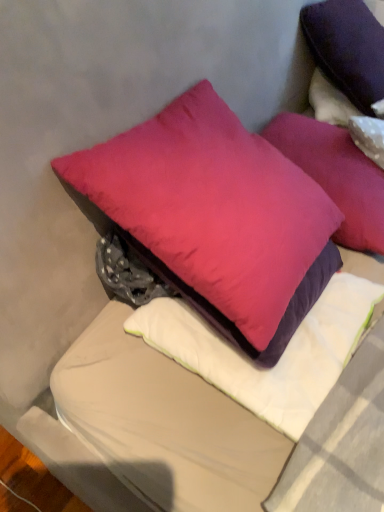
Question: Is purple velvet pillow at upper right, marked as the 5th pillow in a bottom-to-top arrangement, closer to the viewer compared to matte pink pillow at center, marked as the third pillow in a bottom-to-top arrangement?

Choices:
 (A) no
 (B) yes

Answer: (A)

Question: From a real-world perspective, is purple velvet pillow at upper right, marked as the 5th pillow in a bottom-to-top arrangement, on matte pink pillow at center, marked as the third pillow in a bottom-to-top arrangement?

Choices:
 (A) no
 (B) yes

Answer: (B)

Question: Does purple velvet pillow at upper right, marked as the 5th pillow in a bottom-to-top arrangement, touch matte pink pillow at center, which is the 3th pillow from top to bottom?

Choices:
 (A) no
 (B) yes

Answer: (A)

Question: Is purple velvet pillow at upper right, marked as the 5th pillow in a bottom-to-top arrangement, oriented away from matte pink pillow at center, which is the 3th pillow from top to bottom?

Choices:
 (A) yes
 (B) no

Answer: (B)

Question: Can you confirm if purple velvet pillow at upper right, marked as the 5th pillow in a bottom-to-top arrangement, is positioned to the left of matte pink pillow at center, which is the 3th pillow from top to bottom?

Choices:
 (A) no
 (B) yes

Answer: (A)

Question: Considering the positions of purple velvet pillow at upper right, placed as the first pillow when sorted from top to bottom, and satin purple pillow at center, arranged as the 1th pillow when ordered from the bottom, in the image, is purple velvet pillow at upper right, placed as the first pillow when sorted from top to bottom, bigger or smaller than satin purple pillow at center, arranged as the 1th pillow when ordered from the bottom,?

Choices:
 (A) big
 (B) small

Answer: (A)

Question: Considering their positions, is purple velvet pillow at upper right, marked as the 5th pillow in a bottom-to-top arrangement, located in front of or behind satin purple pillow at center, arranged as the 1th pillow when ordered from the bottom?

Choices:
 (A) behind
 (B) front

Answer: (A)

Question: In the image, is purple velvet pillow at upper right, marked as the 5th pillow in a bottom-to-top arrangement, on the left side or the right side of satin purple pillow at center, arranged as the 1th pillow when ordered from the bottom?

Choices:
 (A) left
 (B) right

Answer: (B)

Question: Considering the positions of purple velvet pillow at upper right, marked as the 5th pillow in a bottom-to-top arrangement, and satin purple pillow at center, arranged as the 1th pillow when ordered from the bottom, in the image, is purple velvet pillow at upper right, marked as the 5th pillow in a bottom-to-top arrangement, wider or thinner than satin purple pillow at center, arranged as the 1th pillow when ordered from the bottom,?

Choices:
 (A) thin
 (B) wide

Answer: (B)

Question: In terms of size, does purple matte pillow at upper right, placed as the 4th pillow when sorted from bottom to top, appear bigger or smaller than matte pink pillow at center, marked as the third pillow in a bottom-to-top arrangement?

Choices:
 (A) big
 (B) small

Answer: (B)

Question: Considering the relative positions of purple matte pillow at upper right, the second pillow from the top, and matte pink pillow at center, which is the 3th pillow from top to bottom, in the image provided, is purple matte pillow at upper right, the second pillow from the top, to the left or to the right of matte pink pillow at center, which is the 3th pillow from top to bottom,?

Choices:
 (A) left
 (B) right

Answer: (B)

Question: Is purple matte pillow at upper right, placed as the 4th pillow when sorted from bottom to top, taller or shorter than matte pink pillow at center, which is the 3th pillow from top to bottom?

Choices:
 (A) short
 (B) tall

Answer: (A)

Question: Which is correct: purple matte pillow at upper right, the second pillow from the top, is inside matte pink pillow at center, which is the 3th pillow from top to bottom, or outside of it?

Choices:
 (A) outside
 (B) inside

Answer: (A)

Question: Is purple matte pillow at upper right, the second pillow from the top, in front of or behind satin purple pillow at center, the 5th pillow when ordered from top to bottom, in the image?

Choices:
 (A) front
 (B) behind

Answer: (B)

Question: Is purple matte pillow at upper right, placed as the 4th pillow when sorted from bottom to top, situated inside satin purple pillow at center, arranged as the 1th pillow when ordered from the bottom, or outside?

Choices:
 (A) outside
 (B) inside

Answer: (A)